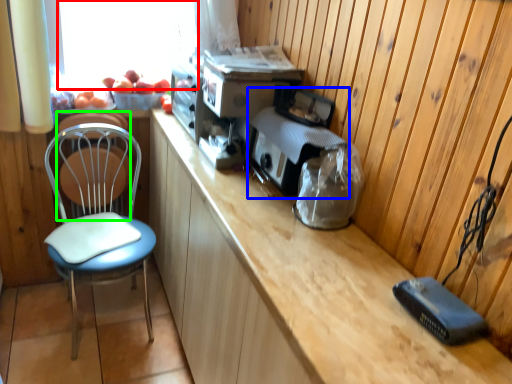
Question: Which is nearer to the window screen (highlighted by a red box)? appliance (highlighted by a blue box) or swivel chair (highlighted by a green box).

Choices:
 (A) appliance
 (B) swivel chair

Answer: (B)